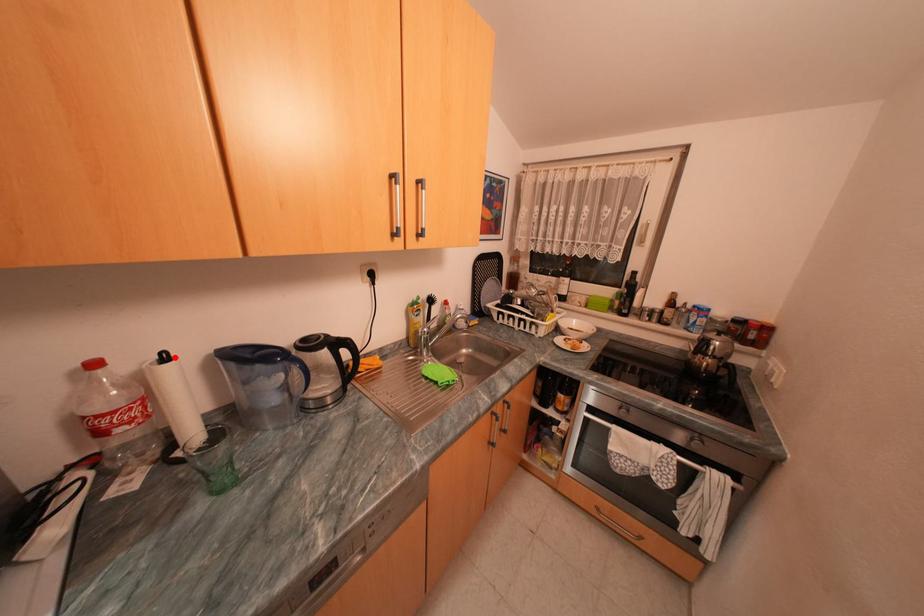
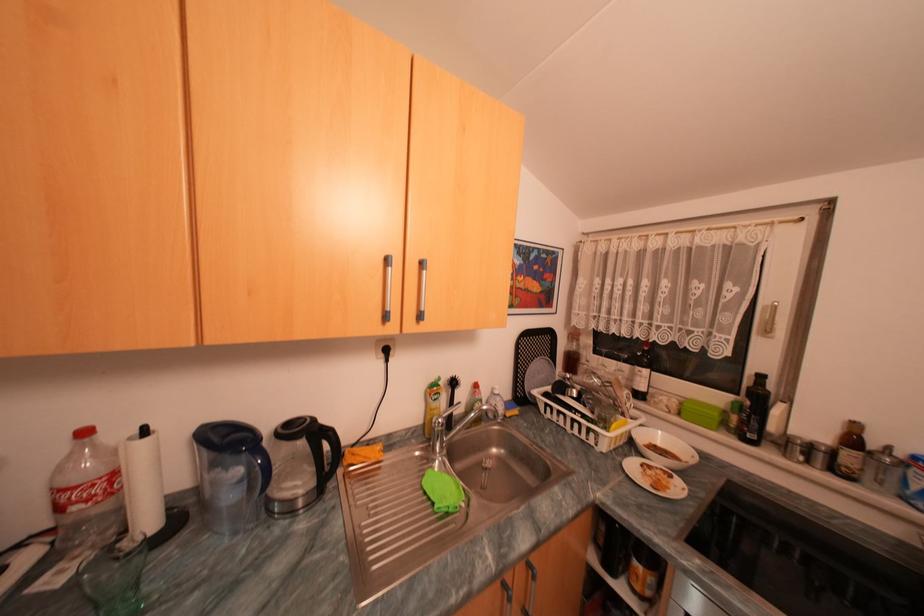
The point at the highlighted location is marked in the first image. Where is the corresponding point in the second image?

(155, 432)